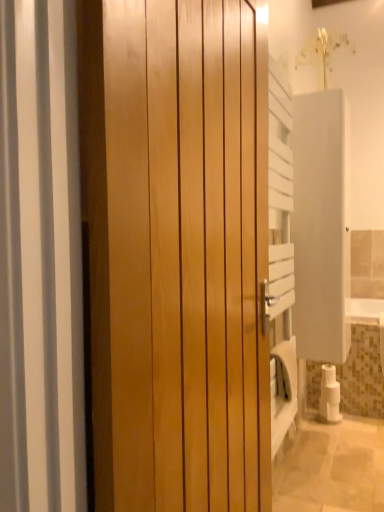
Question: Is glossy wood door at center bigger or smaller than white matte toilet paper at lower right?

Choices:
 (A) small
 (B) big

Answer: (B)

Question: Which is correct: glossy wood door at center is inside white matte toilet paper at lower right, or outside of it?

Choices:
 (A) outside
 (B) inside

Answer: (A)

Question: Estimate the real-world distances between objects in this image. Which object is farther from the white matte toilet paper at lower right?

Choices:
 (A) white matte screen door at right
 (B) glossy wood door at center

Answer: (B)

Question: Which object is positioned closest to the white matte toilet paper at lower right?

Choices:
 (A) glossy wood door at center
 (B) white matte screen door at right

Answer: (B)